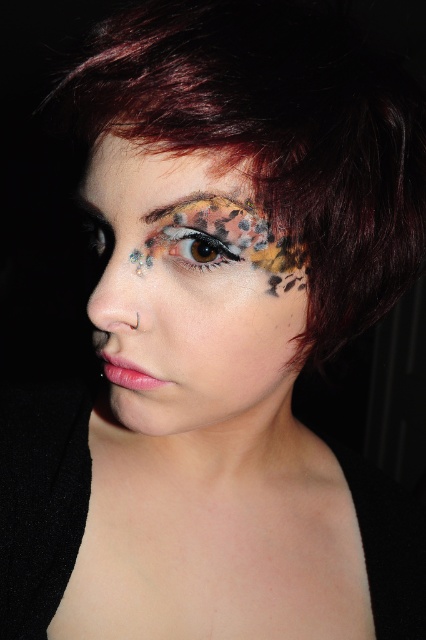
Consider the image. You are a makeup artist analyzing the portrait. You need to determine which of the two multicolored features, the multicolored textured eyebrow at upper center or the multicolored glitter eye at center, is smaller in height. Which one is it?

The multicolored textured eyebrow at upper center is shorter than the multicolored glitter eye at center, so the multicolored textured eyebrow at upper center is smaller in height.

Looking at the multicolored textured eyebrow at upper center and the black matte eye at center, which one appears to be smaller in size?

The multicolored textured eyebrow at upper center has a smaller size compared to the black matte eye at center.

You are a makeup artist preparing to apply a new design to the multicolored textured eyebrow at upper center and the multicolored glitter eye at center. The design requires that the two elements must be spaced exactly 0.4 inches apart. Based on the current spacing, will you need to adjust the placement of either element?

The multicolored textured eyebrow at upper center and multicolored glitter eye at center are currently 0.38 inches apart. Since the required spacing is 0.4 inches, you need to increase the distance between them by 0.02 inches to meet the design requirement.